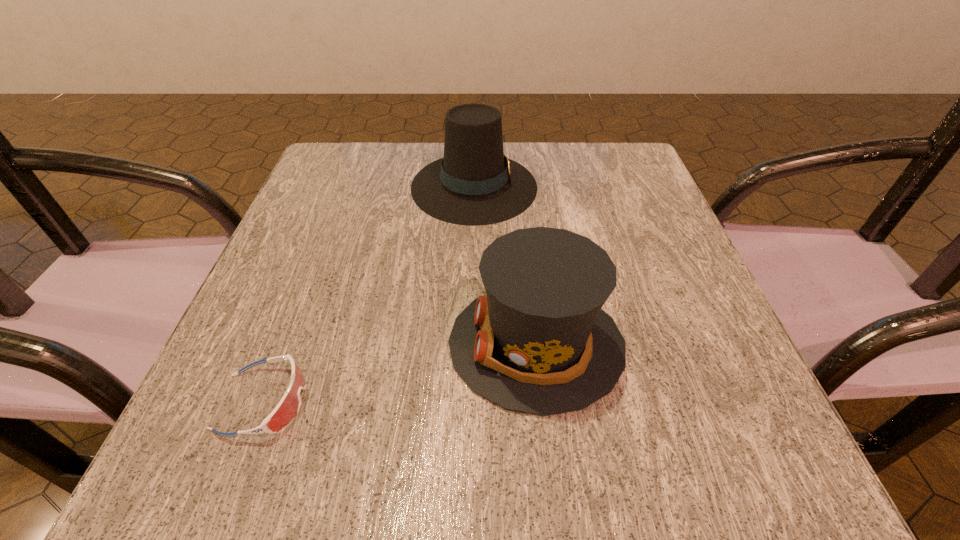
This screenshot has height=540, width=960. I want to click on blank region between the shortest object and the farthest object, so click(x=369, y=294).

In order to click on unoccupied position between the shortest object and the nearer dress hat in this screenshot , I will do `click(400, 373)`.

Identify the location of vacant area that lies between the farthest object and the shortest object. (369, 294).

Where is `vacant region between the goggles and the farthest object`? This screenshot has height=540, width=960. vacant region between the goggles and the farthest object is located at coordinates (369, 294).

This screenshot has width=960, height=540. Find the location of `vacant space in between the nearer dress hat and the shortest object`. vacant space in between the nearer dress hat and the shortest object is located at coordinates (400, 373).

Where is `free space that is in between the leftmost object and the nearer dress hat`? The height and width of the screenshot is (540, 960). free space that is in between the leftmost object and the nearer dress hat is located at coordinates (400, 373).

Where is `free space between the goggles and the nearer dress hat`? Image resolution: width=960 pixels, height=540 pixels. free space between the goggles and the nearer dress hat is located at coordinates (400, 373).

Identify the location of empty space that is in between the leftmost object and the farther dress hat. [x=369, y=294].

Where is `object that is the closest to the goggles`? This screenshot has height=540, width=960. object that is the closest to the goggles is located at coordinates (538, 342).

Select which object is the second closest to the nearer dress hat. Please provide its 2D coordinates. Your answer should be formatted as a tuple, i.e. [(x, y)], where the tuple contains the x and y coordinates of a point satisfying the conditions above.

[(288, 407)]